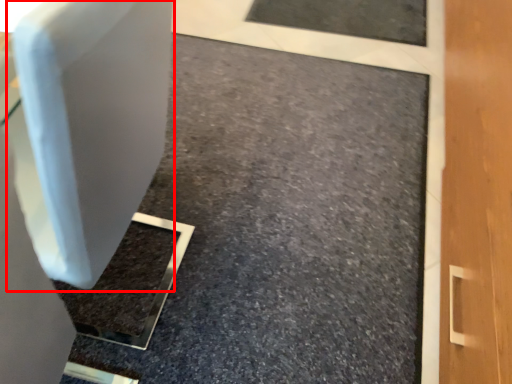
Question: From the image's perspective, considering the relative positions of swivel chair (annotated by the red box) and concrete in the image provided, where is swivel chair (annotated by the red box) located with respect to the staircase?

Choices:
 (A) below
 (B) above

Answer: (B)